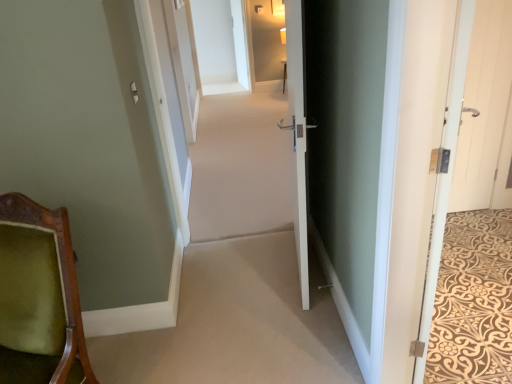
Identify the location of white glossy door at center, which appears as the 1th door when viewed from the left. (298, 135).

What do you see at coordinates (241, 166) in the screenshot?
I see `beige carpet at center` at bounding box center [241, 166].

Where is `white wood door at right, which is the 2th door in left-to-right order`? white wood door at right, which is the 2th door in left-to-right order is located at coordinates (472, 131).

Looking at the image, does beige carpet at center seem bigger or smaller compared to white wooden door at right, the second door from the right?

Clearly, beige carpet at center is larger in size than white wooden door at right, the second door from the right.

Is beige carpet at center not within white wooden door at right, the second door from the right?

Absolutely, beige carpet at center is external to white wooden door at right, the second door from the right.

Consider the image. Is beige carpet at center taller or shorter than white wooden door at right, the 3th door positioned from the left?

In the image, beige carpet at center appears to be taller than white wooden door at right, the 3th door positioned from the left.

Do you think white glossy door at center, which ranks as the 4th door in right-to-left order, is within white wooden door at right, the 3th door positioned from the left, or outside of it?

white glossy door at center, which ranks as the 4th door in right-to-left order, exists outside the volume of white wooden door at right, the 3th door positioned from the left.

From a real-world perspective, is white glossy door at center, which ranks as the 4th door in right-to-left order, physically above white wooden door at right, the second door from the right?

Yes, from a real-world perspective, white glossy door at center, which ranks as the 4th door in right-to-left order, is on top of white wooden door at right, the second door from the right.

From the picture: Is the depth of white glossy door at center, which ranks as the 4th door in right-to-left order, greater than that of white wooden door at right, the 3th door positioned from the left?

Yes, the depth of white glossy door at center, which ranks as the 4th door in right-to-left order, is greater than that of white wooden door at right, the 3th door positioned from the left.

Measure the distance from white glossy door at center, which appears as the 1th door when viewed from the left, to white wooden door at right, the second door from the right.

white glossy door at center, which appears as the 1th door when viewed from the left, is 29.82 inches away from white wooden door at right, the second door from the right.

Is the depth of white glossy door at center, which appears as the 1th door when viewed from the left, less than that of white wood door at right, which is the 2th door in left-to-right order?

No, it is not.

Is white wood door at right, which is the 2th door in left-to-right order, at the back of white glossy door at center, which ranks as the 4th door in right-to-left order?

No, white glossy door at center, which ranks as the 4th door in right-to-left order, is not facing the opposite direction of white wood door at right, which is the 2th door in left-to-right order.

Which is in front, point (300, 52) or point (466, 123)?

The point (300, 52) is more forward.

Considering the sizes of objects white wooden door at right, the second door from the right, and white glossy door at center, which appears as the 1th door when viewed from the left, in the image provided, who is smaller, white wooden door at right, the second door from the right, or white glossy door at center, which appears as the 1th door when viewed from the left,?

white wooden door at right, the second door from the right, is smaller.

Is point (444, 32) less distant than point (298, 80)?

Yes.

Considering the relative positions of white wooden door at right, the 3th door positioned from the left, and white glossy door at center, which ranks as the 4th door in right-to-left order, in the image provided, is white wooden door at right, the 3th door positioned from the left, to the right of white glossy door at center, which ranks as the 4th door in right-to-left order, from the viewer's perspective?

Yes, white wooden door at right, the 3th door positioned from the left, is to the right of white glossy door at center, which ranks as the 4th door in right-to-left order.

From a real-world perspective, is white wooden door at right, the 3th door positioned from the left, located beneath white glossy door at center, which appears as the 1th door when viewed from the left?

Yes, from a real-world perspective, white wooden door at right, the 3th door positioned from the left, is beneath white glossy door at center, which appears as the 1th door when viewed from the left.

Looking at this image, measure the distance between white wooden door at right, the second door from the right, and white wood door at right, the third door positioned from the right.

A distance of 4.31 feet exists between white wooden door at right, the second door from the right, and white wood door at right, the third door positioned from the right.

Is white wooden door at right, the 3th door positioned from the left, oriented towards white wood door at right, which is the 2th door in left-to-right order?

No, white wooden door at right, the 3th door positioned from the left, is not facing towards white wood door at right, which is the 2th door in left-to-right order.

Does white wooden door at right, the second door from the right, have a lesser width compared to white wood door at right, the third door positioned from the right?

Correct, the width of white wooden door at right, the second door from the right, is less than that of white wood door at right, the third door positioned from the right.

The image size is (512, 384). Find the location of `the 1st door to the right of the white wood door at right, which is the 2th door in left-to-right order, starting your count from the anchor`. the 1st door to the right of the white wood door at right, which is the 2th door in left-to-right order, starting your count from the anchor is located at coordinates (417, 177).

Which of these two, green velvet chair at lower left or white wood door at right, which is the 2th door in left-to-right order, is wider?

With larger width is green velvet chair at lower left.

Is green velvet chair at lower left looking in the opposite direction of white wood door at right, which is the 2th door in left-to-right order?

No.

Can you see green velvet chair at lower left touching white wood door at right, which is the 2th door in left-to-right order?

No, green velvet chair at lower left is not with white wood door at right, which is the 2th door in left-to-right order.

Is white wood door at right, which is the 2th door in left-to-right order, located within green velvet chair at lower left?

No, green velvet chair at lower left does not contain white wood door at right, which is the 2th door in left-to-right order.

Does green velvet chair at lower left have a lesser height compared to white glossy door at center, which appears as the 1th door when viewed from the left?

Yes, green velvet chair at lower left is shorter than white glossy door at center, which appears as the 1th door when viewed from the left.

Does green velvet chair at lower left have a larger size compared to white glossy door at center, which appears as the 1th door when viewed from the left?

Indeed, green velvet chair at lower left has a larger size compared to white glossy door at center, which appears as the 1th door when viewed from the left.

Measure the distance between green velvet chair at lower left and white glossy door at center, which appears as the 1th door when viewed from the left.

The distance of green velvet chair at lower left from white glossy door at center, which appears as the 1th door when viewed from the left, is 1.13 meters.

Would you say green velvet chair at lower left is to the left or to the right of white glossy door at center, which appears as the 1th door when viewed from the left, in the picture?

Based on their positions, green velvet chair at lower left is located to the left of white glossy door at center, which appears as the 1th door when viewed from the left.

Which door is the 2nd one when counting from the front of the beige carpet at center? Please provide its 2D coordinates.

[(417, 177)]

Locate an element on the screen. This screenshot has width=512, height=384. the 1st door above the white wooden door at right, the second door from the right (from the image's perspective) is located at coordinates (298, 135).

Estimate the real-world distances between objects in this image. Which object is closer to white wooden door at right, the second door from the right, white glossy door at center, which appears as the 1th door when viewed from the left, or green velvet chair at lower left?

Based on the image, white glossy door at center, which appears as the 1th door when viewed from the left, appears to be nearer to white wooden door at right, the second door from the right.

Estimate the real-world distances between objects in this image. Which object is further from beige carpet at center, white wood door at right, the third door positioned from the right, or white glossy door at center, which ranks as the 4th door in right-to-left order?

Among the two, white wood door at right, the third door positioned from the right, is located further to beige carpet at center.

Consider the image. Looking at the image, which one is located closer to white wooden door at right, the 3th door positioned from the left, beige carpet at center or white glossy door at center, which ranks as the 4th door in right-to-left order?

white glossy door at center, which ranks as the 4th door in right-to-left order, lies closer to white wooden door at right, the 3th door positioned from the left, than the other object.

Estimate the real-world distances between objects in this image. Which object is further from white glossy door at center, which ranks as the 4th door in right-to-left order, beige carpet at center or white wood door at right, the 4th door from the left?

beige carpet at center.

Which object lies further to the anchor point white wooden door at right, the second door from the right, white glossy door at center, which ranks as the 4th door in right-to-left order, or white wood door at right, which is counted as the first door, starting from the right?

Based on the image, white wood door at right, which is counted as the first door, starting from the right, appears to be further to white wooden door at right, the second door from the right.

Which object lies nearer to the anchor point white wood door at right, the 4th door from the left, white wood door at right, the third door positioned from the right, or white wooden door at right, the 3th door positioned from the left?

white wood door at right, the third door positioned from the right.

From the image, which object appears to be nearer to white glossy door at center, which ranks as the 4th door in right-to-left order, white wood door at right, the third door positioned from the right, or green velvet chair at lower left?

white wood door at right, the third door positioned from the right, lies closer to white glossy door at center, which ranks as the 4th door in right-to-left order, than the other object.

From the image, which object appears to be nearer to white wood door at right, which is the 2th door in left-to-right order, beige carpet at center or white glossy door at center, which appears as the 1th door when viewed from the left?

white glossy door at center, which appears as the 1th door when viewed from the left.

Where is `door positioned between white wood door at right, which is the 2th door in left-to-right order, and white glossy door at center, which ranks as the 4th door in right-to-left order, from near to far`? door positioned between white wood door at right, which is the 2th door in left-to-right order, and white glossy door at center, which ranks as the 4th door in right-to-left order, from near to far is located at coordinates (417, 177).

Where is `plain between green velvet chair at lower left and white glossy door at center, which ranks as the 4th door in right-to-left order, in the horizontal direction`? This screenshot has width=512, height=384. plain between green velvet chair at lower left and white glossy door at center, which ranks as the 4th door in right-to-left order, in the horizontal direction is located at coordinates (241, 166).

This screenshot has width=512, height=384. I want to click on door positioned between white wooden door at right, the 3th door positioned from the left, and white wood door at right, which is counted as the first door, starting from the right, from near to far, so click(x=298, y=135).

Locate an element on the screen. The height and width of the screenshot is (384, 512). door between green velvet chair at lower left and white wood door at right, which is the 2th door in left-to-right order, from left to right is located at coordinates (298, 135).